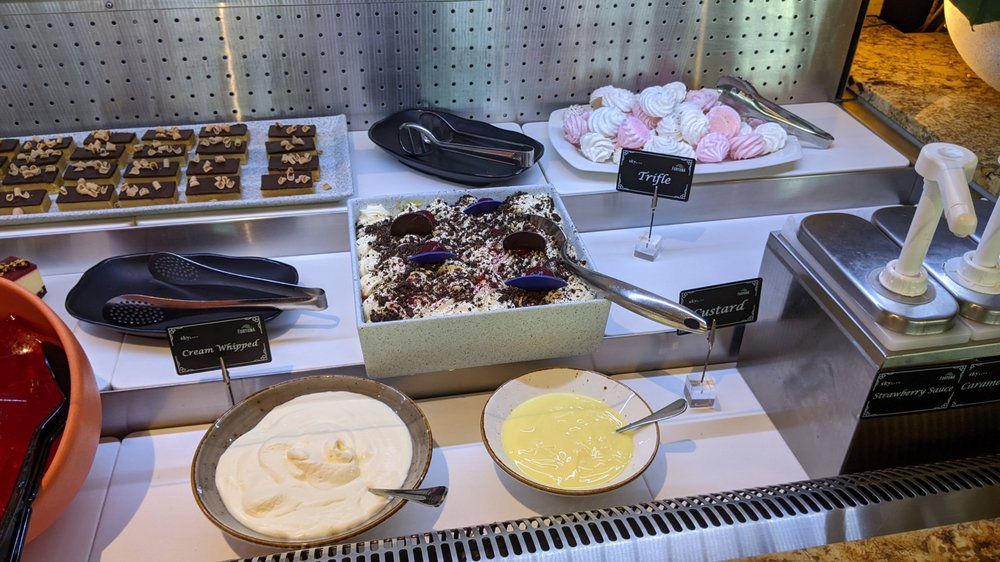
Identify the location of silver wall. This screenshot has height=562, width=1000. (418, 48).